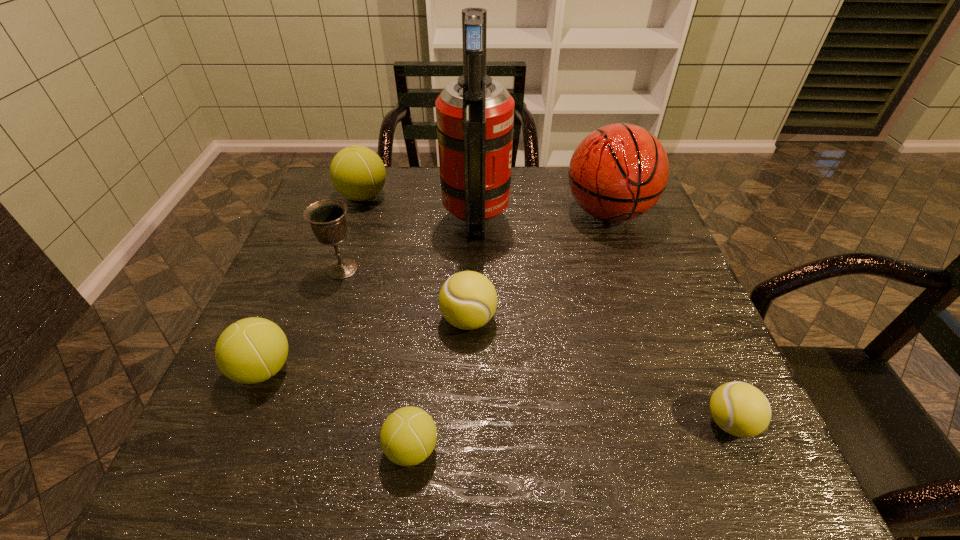
Where is `the tallest object`? Image resolution: width=960 pixels, height=540 pixels. the tallest object is located at coordinates (475, 114).

In order to click on red fire extinguisher in this screenshot , I will do `click(475, 114)`.

Where is `basketball`? Image resolution: width=960 pixels, height=540 pixels. basketball is located at coordinates (618, 172).

Locate an element on the screen. chalice is located at coordinates (327, 218).

Locate an element on the screen. The image size is (960, 540). bronze chalice is located at coordinates pyautogui.click(x=327, y=218).

Identify the location of the farthest green tennis ball. (358, 173).

The width and height of the screenshot is (960, 540). What are the coordinates of `the farthest tennis ball` in the screenshot? It's located at (358, 173).

Where is `the bigger yellow tennis ball`? The height and width of the screenshot is (540, 960). the bigger yellow tennis ball is located at coordinates (468, 300).

The height and width of the screenshot is (540, 960). In order to click on the left yellow tennis ball in this screenshot , I will do (468, 300).

Find the location of a particular element. The width and height of the screenshot is (960, 540). the sixth farthest object is located at coordinates (251, 350).